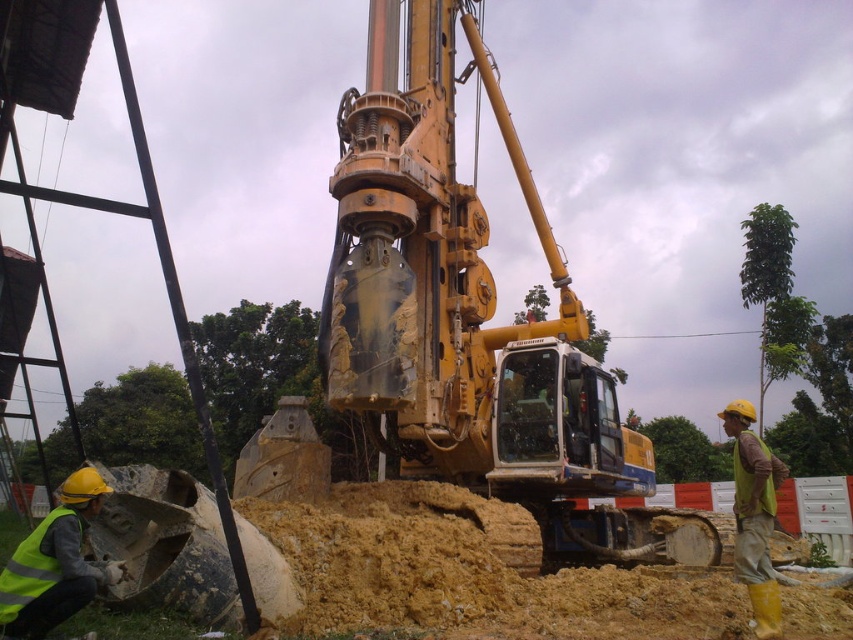
From the picture: Who is taller, reflective yellow vest at lower left or yellow reflective vest at right?

Standing taller between the two is yellow reflective vest at right.

Is point (54, 596) positioned in front of point (741, 508)?

Yes, it is.

The image size is (853, 640). In order to click on reflective yellow vest at lower left in this screenshot , I will do `click(55, 563)`.

Describe the element at coordinates (467, 316) in the screenshot. Image resolution: width=853 pixels, height=640 pixels. I see `yellow metallic excavator at center` at that location.

Who is positioned more to the right, yellow metallic excavator at center or yellow reflective vest at right?

yellow reflective vest at right

You are a GUI agent. You are given a task and a screenshot of the screen. Output one action in this format:
    pyautogui.click(x=<x>, y=<y>)
    Task: Click on the yellow metallic excavator at center
    
    Given the screenshot: What is the action you would take?
    pyautogui.click(x=467, y=316)

At what (x,y) coordinates should I click in order to perform the action: click on yellow metallic excavator at center. Please return your answer as a coordinate pair (x, y). Image resolution: width=853 pixels, height=640 pixels. Looking at the image, I should click on (467, 316).

Is yellow metallic excavator at center behind reflective yellow vest at lower left?

That is True.

Is yellow metallic excavator at center smaller than reflective yellow vest at lower left?

Yes, yellow metallic excavator at center is smaller than reflective yellow vest at lower left.

Does point (440, 220) come farther from viewer compared to point (25, 556)?

Yes, it is behind point (25, 556).

What are the coordinates of `yellow metallic excavator at center` in the screenshot? It's located at coord(467,316).